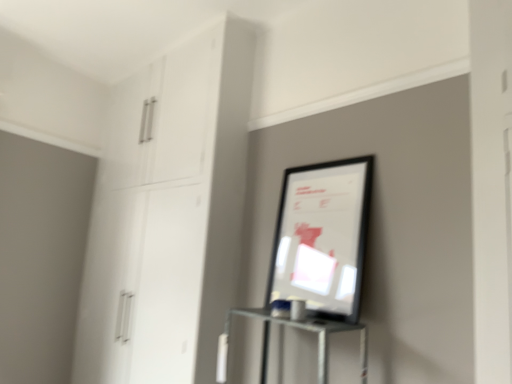
Question: Considering the relative sizes of matte black picture frame at center and white glossy cabinet at upper left in the image provided, is matte black picture frame at center thinner than white glossy cabinet at upper left?

Choices:
 (A) yes
 (B) no

Answer: (A)

Question: Can you confirm if matte black picture frame at center is wider than white glossy cabinet at upper left?

Choices:
 (A) yes
 (B) no

Answer: (B)

Question: Is matte black picture frame at center shorter than white glossy cabinet at upper left?

Choices:
 (A) yes
 (B) no

Answer: (A)

Question: Considering the relative sizes of matte black picture frame at center and white glossy cabinet at upper left in the image provided, is matte black picture frame at center bigger than white glossy cabinet at upper left?

Choices:
 (A) yes
 (B) no

Answer: (B)

Question: Are matte black picture frame at center and white glossy cabinet at upper left located far from each other?

Choices:
 (A) no
 (B) yes

Answer: (A)

Question: Does matte black picture frame at center come behind white glossy cabinet at upper left?

Choices:
 (A) no
 (B) yes

Answer: (A)

Question: Is white glossy cabinet at upper left positioned before matte black picture frame at center?

Choices:
 (A) no
 (B) yes

Answer: (A)

Question: Does white glossy cabinet at upper left appear on the right side of matte black picture frame at center?

Choices:
 (A) yes
 (B) no

Answer: (B)

Question: Is white glossy cabinet at upper left not close to matte black picture frame at center?

Choices:
 (A) yes
 (B) no

Answer: (B)

Question: Considering the relative positions of white glossy cabinet at upper left and matte black picture frame at center in the image provided, is white glossy cabinet at upper left to the left of matte black picture frame at center from the viewer's perspective?

Choices:
 (A) yes
 (B) no

Answer: (A)

Question: From a real-world perspective, does white glossy cabinet at upper left stand above matte black picture frame at center?

Choices:
 (A) yes
 (B) no

Answer: (A)

Question: From the image's perspective, is white glossy cabinet at upper left located beneath matte black picture frame at center?

Choices:
 (A) no
 (B) yes

Answer: (B)

Question: In the image, is white glossy cabinet at upper left on the left side or the right side of matte black picture frame at center?

Choices:
 (A) right
 (B) left

Answer: (B)